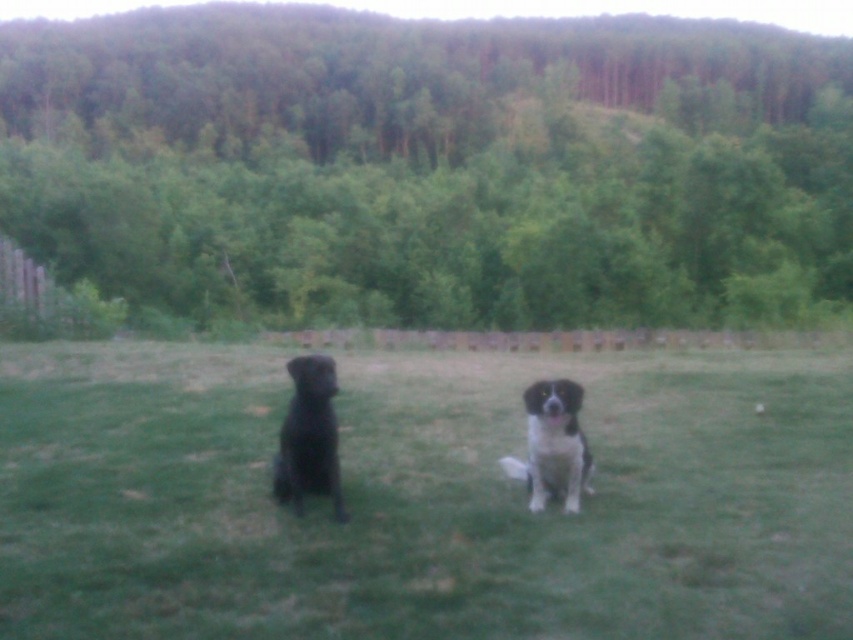
Question: Based on their relative distances, which object is nearer to the black and white fur dog at center?

Choices:
 (A) black matte dog at left
 (B) green leafy trees at upper center
 (C) black fur dog at center

Answer: (A)

Question: Which of the following is the farthest from the observer?

Choices:
 (A) black and white fur dog at center
 (B) green leafy trees at upper center

Answer: (B)

Question: Is green leafy trees at upper center closer to camera compared to black fur dog at center?

Choices:
 (A) yes
 (B) no

Answer: (B)

Question: Considering the real-world distances, which object is farthest from the black fur dog at center?

Choices:
 (A) black matte dog at left
 (B) green leafy trees at upper center

Answer: (B)

Question: Does black fur dog at center have a lesser width compared to black matte dog at left?

Choices:
 (A) yes
 (B) no

Answer: (B)

Question: Does green leafy trees at upper center have a smaller size compared to black and white fur dog at center?

Choices:
 (A) no
 (B) yes

Answer: (A)